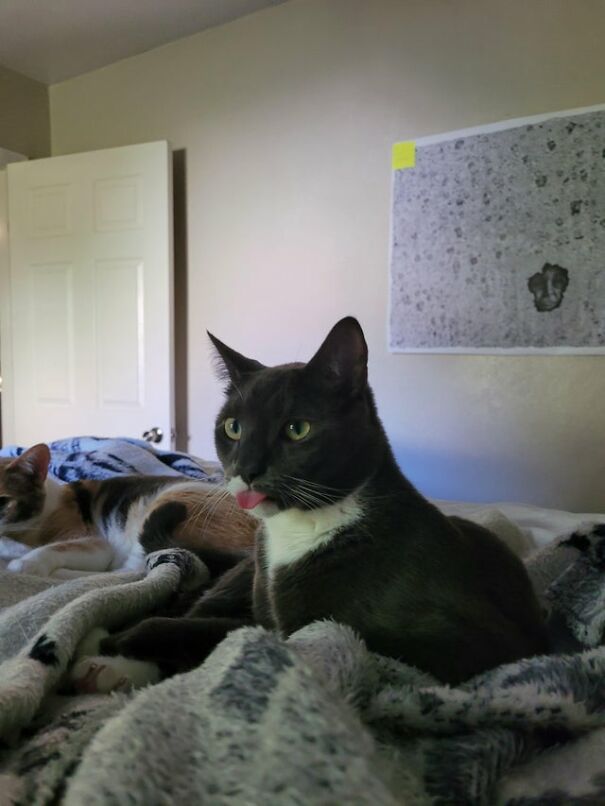
You are a GUI agent. You are given a task and a screenshot of the screen. Output one action in this format:
    pyautogui.click(x=<x>, y=<y>)
    Task: Click on the door knob to open door
    
    Given the screenshot: What is the action you would take?
    pyautogui.click(x=152, y=435)